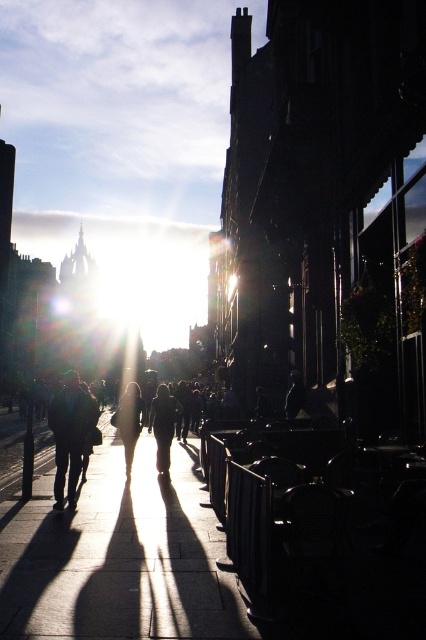
Question: Can you confirm if silhouette coat at center is positioned below matte black person at center?

Choices:
 (A) yes
 (B) no

Answer: (B)

Question: Which of these objects is positioned farthest from the dark fabric jacket at center?

Choices:
 (A) smooth concrete sidewalk at center
 (B) silhouette coat at center
 (C) matte black person at center
 (D) dark clothing figure at center

Answer: (B)

Question: In this image, where is smooth concrete sidewalk at center located relative to silhouette coat at center?

Choices:
 (A) left
 (B) right

Answer: (B)

Question: Which object is farther from the camera taking this photo?

Choices:
 (A) dark fabric jacket at center
 (B) matte black person at center

Answer: (A)

Question: Which point is closer to the camera taking this photo?

Choices:
 (A) (150, 410)
 (B) (124, 458)
 (C) (68, 387)
 (D) (296, 387)

Answer: (C)

Question: Can you confirm if silhouette coat at center is thinner than dark fabric jacket at center?

Choices:
 (A) yes
 (B) no

Answer: (B)